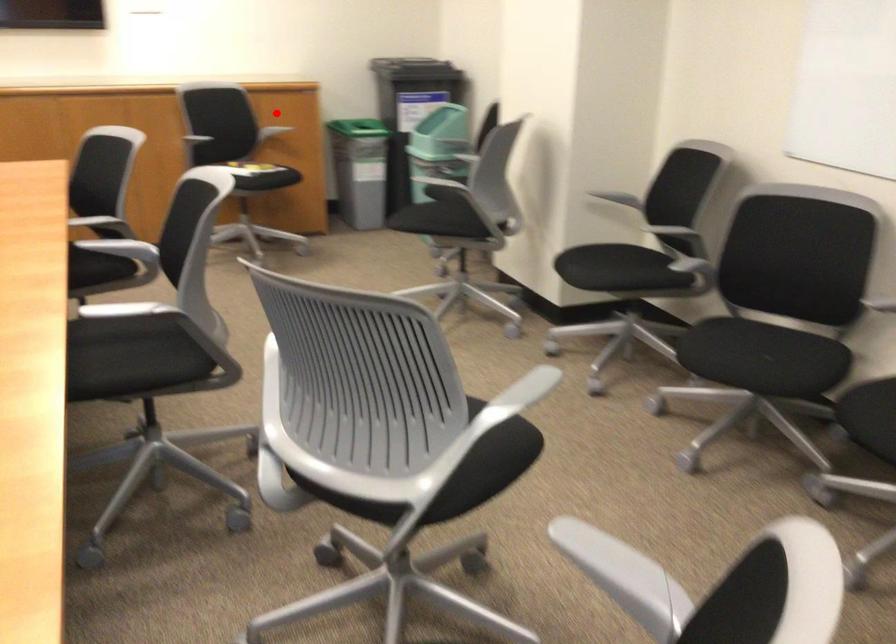
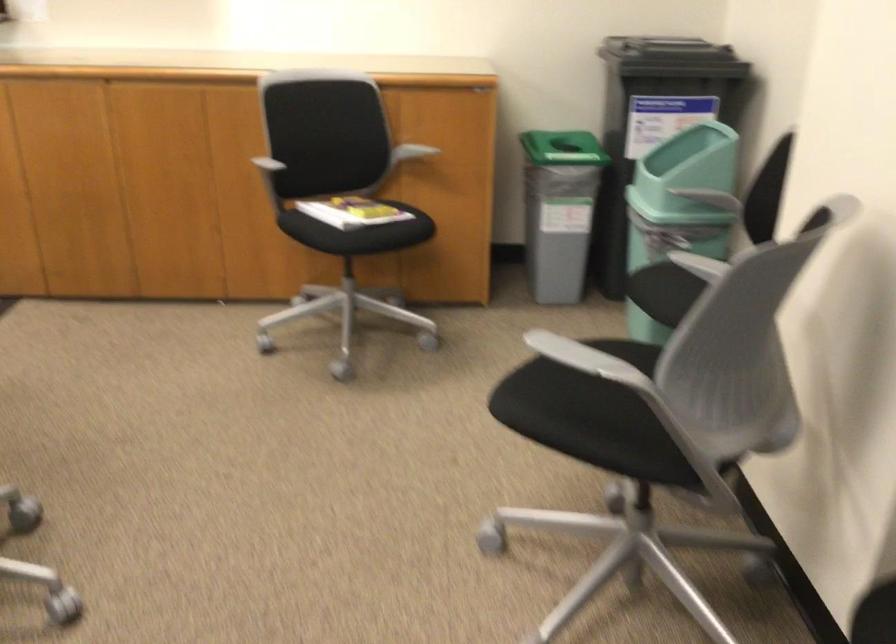
Question: I am providing you with two images of the same scene from different viewpoints. A red point is shown in image1. For the corresponding object point in image2, is it positioned nearer or farther from the camera?

Choices:
 (A) Nearer
 (B) Farther

Answer: (A)